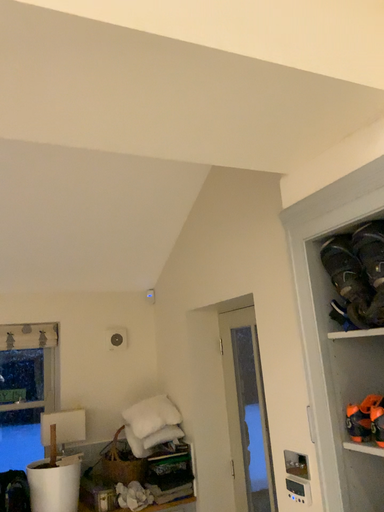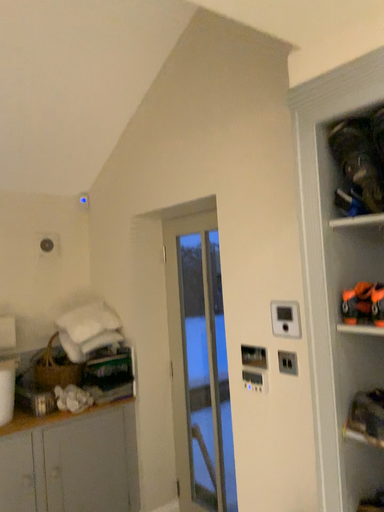
Question: How did the camera likely rotate when shooting the video?

Choices:
 (A) rotated right
 (B) rotated left

Answer: (A)